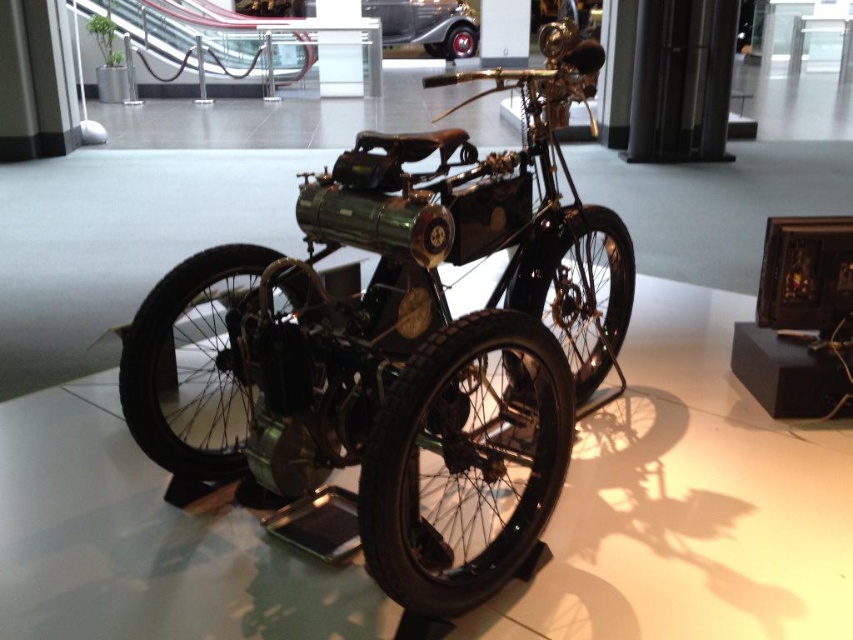
Question: Is shiny black motorcycle at center in front of shiny chrome car at center?

Choices:
 (A) yes
 (B) no

Answer: (A)

Question: Is shiny black motorcycle at center to the left of shiny chrome car at center from the viewer's perspective?

Choices:
 (A) no
 (B) yes

Answer: (B)

Question: Among these objects, which one is nearest to the camera?

Choices:
 (A) shiny chrome car at center
 (B) shiny black motorcycle at center

Answer: (B)

Question: Which of the following is the closest to the observer?

Choices:
 (A) (514, 330)
 (B) (437, 44)

Answer: (A)

Question: Considering the relative positions of shiny black motorcycle at center and shiny chrome car at center in the image provided, where is shiny black motorcycle at center located with respect to shiny chrome car at center?

Choices:
 (A) above
 (B) below

Answer: (B)